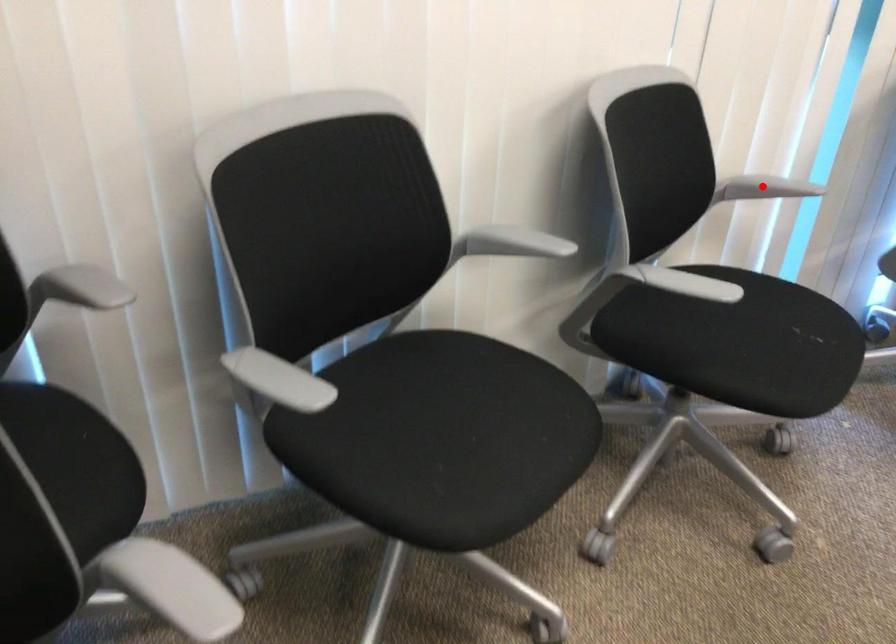
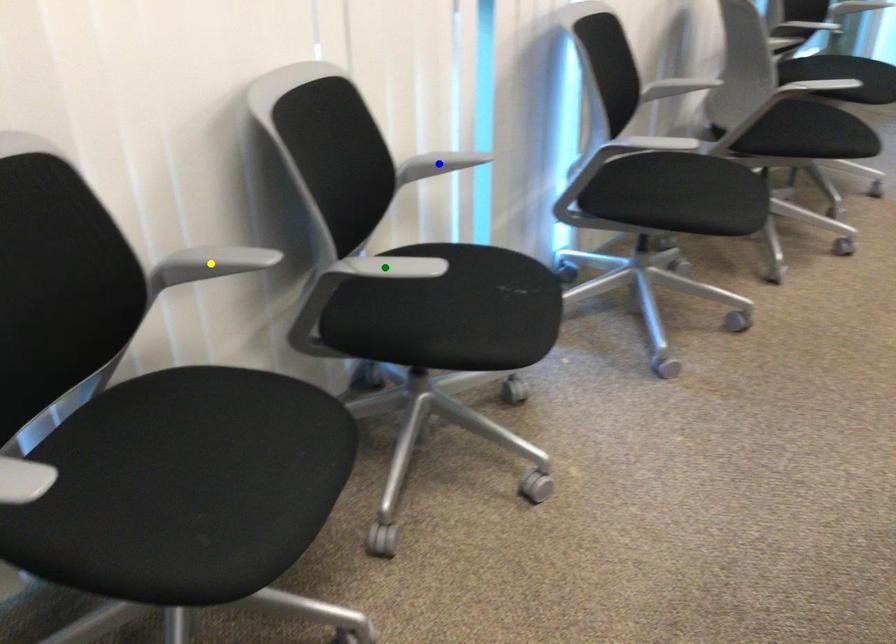
Question: I am providing you with two images of the same scene from different viewpoints. A red point is marked on the first image. You are given multiple points on the second image. Which point in image 2 represents the same 3d spot as the red point in image 1?

Choices:
 (A) blue point
 (B) green point
 (C) yellow point

Answer: (A)